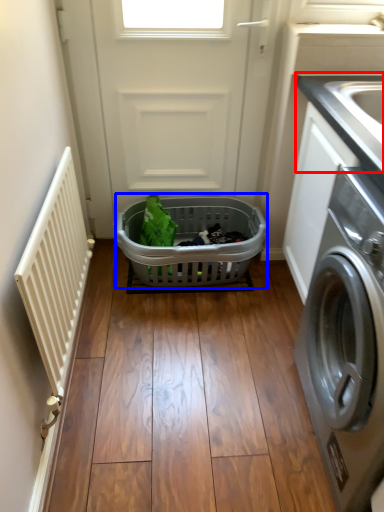
Question: Which object appears farthest to the camera in this image, counter top (highlighted by a red box) or basket (highlighted by a blue box)?

Choices:
 (A) counter top
 (B) basket

Answer: (B)